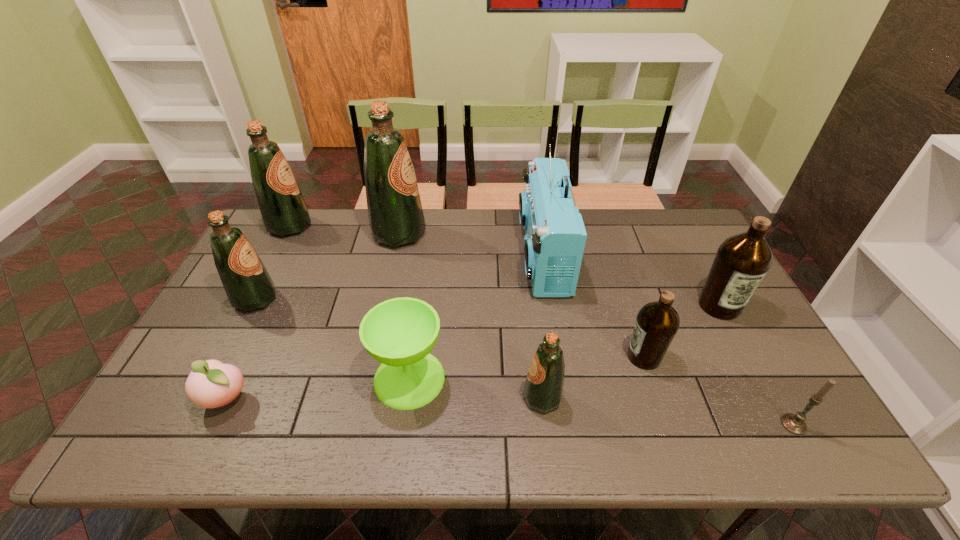
At what (x,y) coordinates should I click in order to perform the action: click on the tallest object. Please return your answer as a coordinate pair (x, y). Looking at the image, I should click on (395, 213).

Locate an element on the screen. The height and width of the screenshot is (540, 960). the biggest green olive oil is located at coordinates (395, 213).

The width and height of the screenshot is (960, 540). Find the location of `the third smallest green olive oil`. the third smallest green olive oil is located at coordinates (284, 211).

Locate an element on the screen. blue radio receiver is located at coordinates (555, 235).

The width and height of the screenshot is (960, 540). Identify the location of the third farthest green olive oil. (248, 285).

You are a GUI agent. You are given a task and a screenshot of the screen. Output one action in this format:
    pyautogui.click(x=<x>, y=<y>)
    Task: Click on the rightmost olive oil
    This screenshot has width=960, height=540.
    Given the screenshot: What is the action you would take?
    pyautogui.click(x=742, y=261)

I want to click on the farther brown olive oil, so click(x=742, y=261).

You are a GUI agent. You are given a task and a screenshot of the screen. Output one action in this format:
    pyautogui.click(x=<x>, y=<y>)
    Task: Click on the nearest olive oil
    
    Given the screenshot: What is the action you would take?
    pyautogui.click(x=543, y=389)

Identify the location of the smallest green olive oil. The height and width of the screenshot is (540, 960). tap(543, 389).

Find the location of `the nearer brown olive oil`. the nearer brown olive oil is located at coordinates (657, 323).